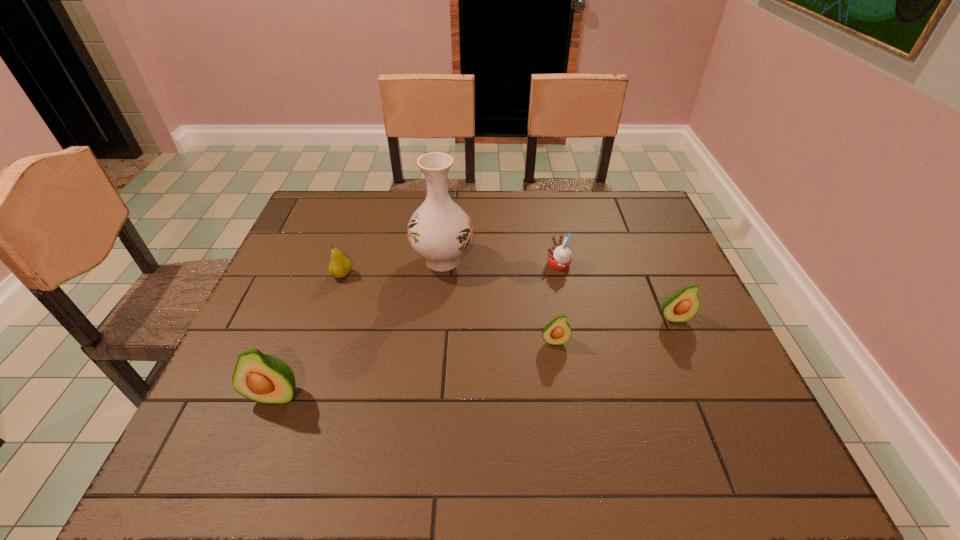
Where is `vacant region located on the cut side of the second nearest object`? The image size is (960, 540). vacant region located on the cut side of the second nearest object is located at coordinates (559, 367).

Image resolution: width=960 pixels, height=540 pixels. Find the location of `vacant area located on the cut side of the rightmost avocado`. vacant area located on the cut side of the rightmost avocado is located at coordinates (703, 387).

Where is `free space located 0.320m on the left of the fourth object from right to left`? The width and height of the screenshot is (960, 540). free space located 0.320m on the left of the fourth object from right to left is located at coordinates (299, 260).

Where is `vacant position located on the left of the pear`? This screenshot has height=540, width=960. vacant position located on the left of the pear is located at coordinates (302, 275).

Identify the location of vacant space situated on the front-facing side of the muffin. The height and width of the screenshot is (540, 960). (471, 265).

The width and height of the screenshot is (960, 540). I want to click on free spot located 0.180m on the front-facing side of the muffin, so click(482, 265).

You are a GUI agent. You are given a task and a screenshot of the screen. Output one action in this format:
    pyautogui.click(x=<x>, y=<y>)
    Task: Click on the vacant space situated on the front-facing side of the muffin
    
    Given the screenshot: What is the action you would take?
    pyautogui.click(x=461, y=265)

Locate an element on the screen. The width and height of the screenshot is (960, 540). object present at the near edge is located at coordinates (264, 378).

The height and width of the screenshot is (540, 960). What are the coordinates of `avocado that is at the left edge` in the screenshot? It's located at (264, 378).

Locate an element on the screen. Image resolution: width=960 pixels, height=540 pixels. pear present at the left edge is located at coordinates (339, 267).